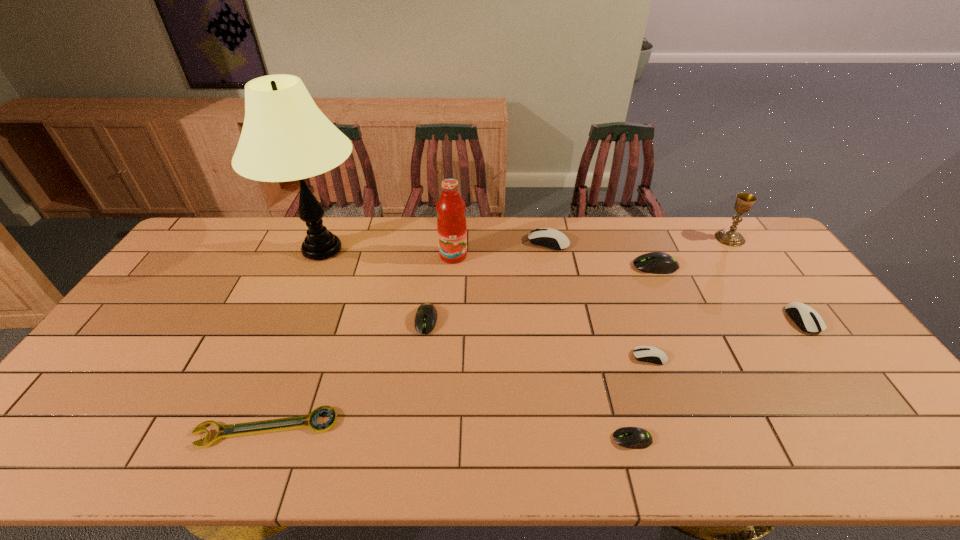
The height and width of the screenshot is (540, 960). I want to click on the closest white mouse to the shortest object, so click(x=644, y=353).

Point out which gray computer mouse is positioned as the nearest to the nearest white mouse. Please provide its 2D coordinates. Your answer should be formatted as a tuple, i.e. [(x, y)], where the tuple contains the x and y coordinates of a point satisfying the conditions above.

[(629, 437)]

Locate an element on the screen. gray computer mouse that is the second closest to the shortest computer mouse is located at coordinates pyautogui.click(x=655, y=262).

The width and height of the screenshot is (960, 540). I want to click on free space that satisfies the following two spatial constraints: 1. on the back side of the second white mouse from right to left; 2. on the left side of the chalice, so click(608, 238).

You are a GUI agent. You are given a task and a screenshot of the screen. Output one action in this format:
    pyautogui.click(x=<x>, y=<y>)
    Task: Click on the free location that satisfies the following two spatial constraints: 1. on the front side of the biggest white mouse; 2. on the left side of the second white mouse from right to left
    The width and height of the screenshot is (960, 540).
    Given the screenshot: What is the action you would take?
    pyautogui.click(x=570, y=357)

Where is `blank area in the image that satisfies the following two spatial constraints: 1. on the back side of the chalice; 2. on the left side of the shortest object`? Image resolution: width=960 pixels, height=540 pixels. blank area in the image that satisfies the following two spatial constraints: 1. on the back side of the chalice; 2. on the left side of the shortest object is located at coordinates (341, 238).